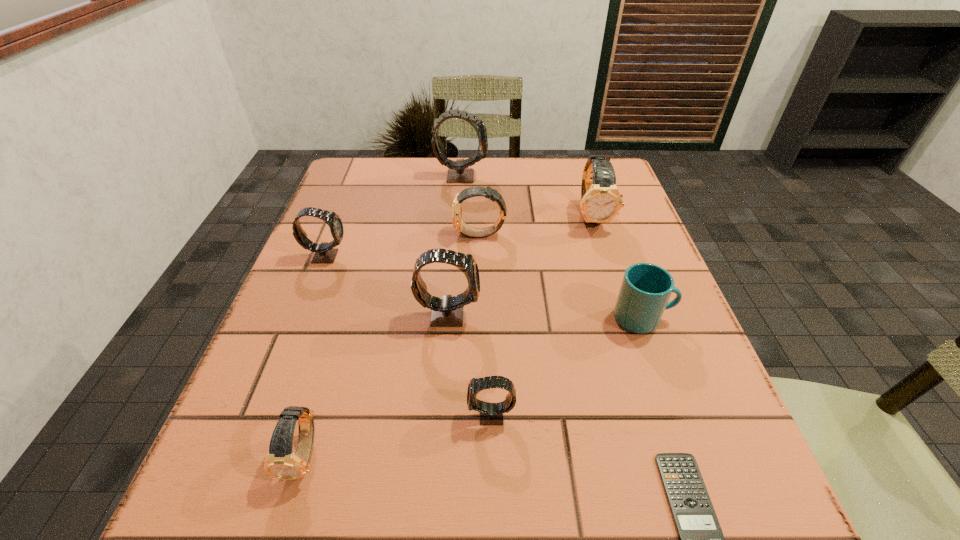
This screenshot has height=540, width=960. What are the coordinates of `the second closest gold watch relative to the smallest gold watch` in the screenshot? It's located at (601, 201).

You are a GUI agent. You are given a task and a screenshot of the screen. Output one action in this format:
    pyautogui.click(x=<x>, y=<y>)
    Task: Click on the vacant region that satisfies the following two spatial constraints: 1. on the face of the rightmost gold watch; 2. on the face of the nearest gray watch
    The image size is (960, 540).
    Given the screenshot: What is the action you would take?
    pyautogui.click(x=656, y=415)

This screenshot has width=960, height=540. In order to click on vacant space that satisfies the following two spatial constraints: 1. on the face of the rightmost gold watch; 2. on the face of the nearest gray watch in this screenshot , I will do `click(656, 415)`.